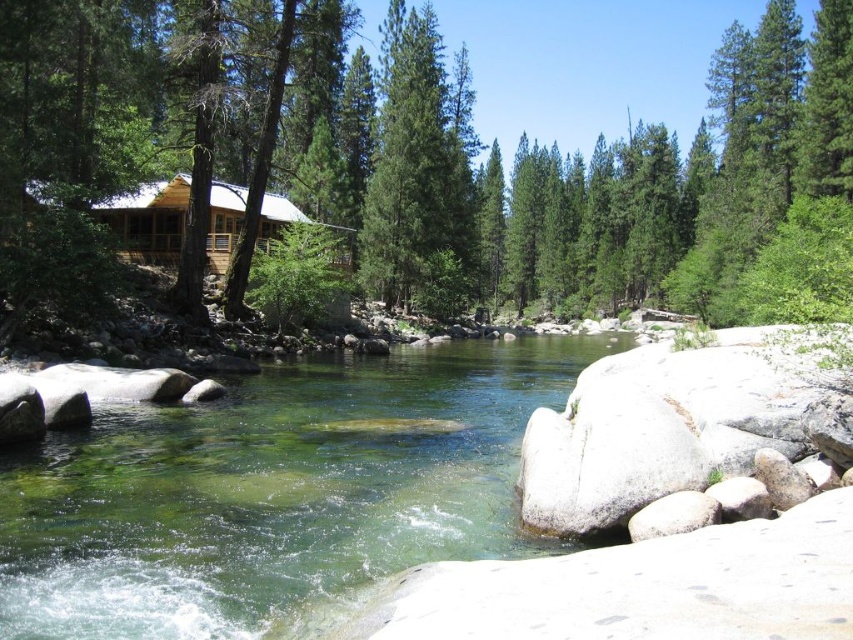
I want to click on clear glass water at center, so click(276, 493).

Does clear glass water at center have a larger size compared to green textured pine tree at center?

No.

What do you see at coordinates (276, 493) in the screenshot? Image resolution: width=853 pixels, height=640 pixels. I see `clear glass water at center` at bounding box center [276, 493].

Locate an element on the screen. The width and height of the screenshot is (853, 640). clear glass water at center is located at coordinates (276, 493).

Is green textured tree at center closer to the viewer compared to clear glass water at center?

No, it is not.

Which is behind, point (538, 152) or point (173, 582)?

The point (538, 152) is behind.

Locate an element on the screen. green textured tree at center is located at coordinates (409, 157).

Is green textured tree at center smaller than green textured pine tree at center?

No.

Looking at this image, who is shorter, green textured tree at center or green textured pine tree at center?

green textured pine tree at center

Which is in front, point (146, 116) or point (405, 243)?

Point (146, 116) is in front.

Locate an element on the screen. green textured tree at center is located at coordinates (409, 157).